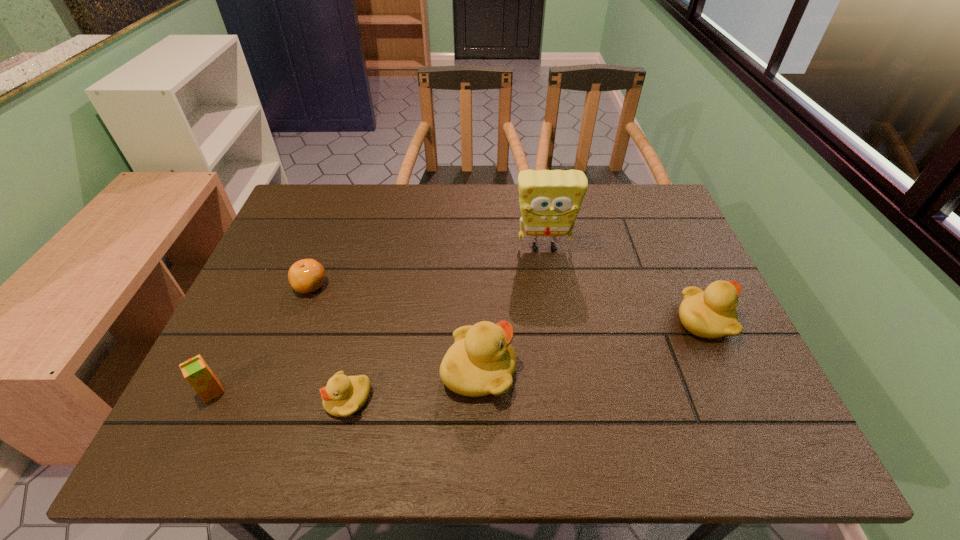
This screenshot has height=540, width=960. I want to click on blank region between the shortest duckling and the rightmost object, so click(x=526, y=360).

Identify the location of vacant space that's between the rightmost duckling and the second object from right to left. (624, 284).

In order to click on free spot between the fifth object from right to left and the rightmost object in this screenshot , I will do `click(507, 303)`.

The height and width of the screenshot is (540, 960). In order to click on free spot between the clementine and the leftmost object in this screenshot , I will do `click(261, 339)`.

Image resolution: width=960 pixels, height=540 pixels. I want to click on free point between the rightmost object and the sponge, so click(624, 284).

Identify the location of the fourth closest object to the leftmost object. (550, 200).

Locate an element on the screen. the fourth closest object relative to the shortest duckling is located at coordinates (550, 200).

Find the location of a particular element. Image resolution: width=960 pixels, height=540 pixels. duckling identified as the closest to the rightmost duckling is located at coordinates (482, 361).

Locate an element on the screen. The height and width of the screenshot is (540, 960). the second closest duckling to the rightmost object is located at coordinates (343, 395).